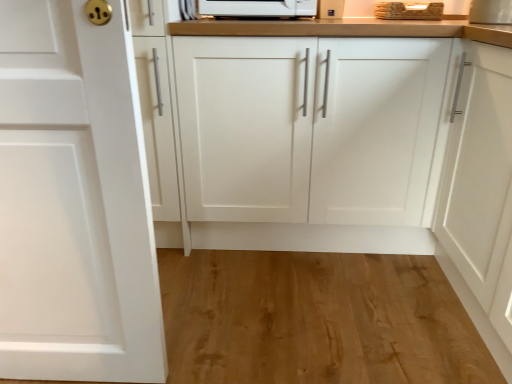
At what (x,y) coordinates should I click in order to perform the action: click on natural wood flooring at lower center. Please return your answer as a coordinate pair (x, y). This screenshot has height=384, width=512. Looking at the image, I should click on (316, 319).

Where is `white matte cabinet at center, which appears as the second cabinetry when viewed from the left`? This screenshot has width=512, height=384. white matte cabinet at center, which appears as the second cabinetry when viewed from the left is located at coordinates [310, 128].

Find the location of a particular element. Image resolution: width=512 pixels, height=384 pixels. natural wood flooring at lower center is located at coordinates (316, 319).

Does natural wood flooring at lower center lie in front of metallic silver toaster at upper center?

Yes.

Does point (301, 365) come farther from viewer compared to point (332, 18)?

No, (301, 365) is closer to viewer.

From a real-world perspective, is natural wood flooring at lower center over metallic silver toaster at upper center?

Incorrect, from a real-world perspective, natural wood flooring at lower center is lower than metallic silver toaster at upper center.

In the scene shown: From the image's perspective, between natural wood flooring at lower center and metallic silver toaster at upper center, which one is located above?

metallic silver toaster at upper center appears higher in the image.

Considering the positions of objects white matte cabinet at center, which appears as the second cabinetry when viewed from the left, and metallic silver toaster at upper center in the image provided, who is behind, white matte cabinet at center, which appears as the second cabinetry when viewed from the left, or metallic silver toaster at upper center?

metallic silver toaster at upper center is more distant.

From a real-world perspective, is white matte cabinet at center, which appears as the second cabinetry when viewed from the left, on top of metallic silver toaster at upper center?

No.

Considering the sizes of white matte cabinet at center, which is the 1th cabinetry in back-to-front order, and metallic silver toaster at upper center in the image, is white matte cabinet at center, which is the 1th cabinetry in back-to-front order, wider or thinner than metallic silver toaster at upper center?

Considering their sizes, white matte cabinet at center, which is the 1th cabinetry in back-to-front order, looks broader than metallic silver toaster at upper center.

Is there a large distance between white matte cabinet at center, the first cabinetry in the right-to-left sequence, and metallic silver toaster at upper center?

Actually, white matte cabinet at center, the first cabinetry in the right-to-left sequence, and metallic silver toaster at upper center are a little close together.

Is white matte cabinet at center, which is the 1th cabinetry in back-to-front order, located outside natural wood flooring at lower center?

Yes.

Which is further, (419, 80) or (212, 351)?

Positioned behind is point (419, 80).

Is white matte cabinet at center, which is the 1th cabinetry in back-to-front order, taller or shorter than natural wood flooring at lower center?

Considering their sizes, white matte cabinet at center, which is the 1th cabinetry in back-to-front order, has more height than natural wood flooring at lower center.

From the image's perspective, which one is positioned higher, white matte cabinet at center, acting as the 2th cabinetry starting from the front, or natural wood flooring at lower center?

white matte cabinet at center, acting as the 2th cabinetry starting from the front.

Consider the image. Which object is further away from the camera, white matte cabinet door at left, which is the 1th cabinetry from front to back, or wooden at upper right?

Positioned behind is wooden at upper right.

Looking at this image, from the image's perspective, which object appears higher, white matte cabinet door at left, placed as the first cabinetry when sorted from left to right, or wooden at upper right?

wooden at upper right is shown above in the image.

Would you say white matte cabinet door at left, which is the 1th cabinetry from front to back, is inside or outside wooden at upper right?

white matte cabinet door at left, which is the 1th cabinetry from front to back, is outside wooden at upper right.

Would you consider white matte cabinet door at left, acting as the 2th cabinetry starting from the back, to be distant from wooden at upper right?

Yes, white matte cabinet door at left, acting as the 2th cabinetry starting from the back, is far from wooden at upper right.

Is point (335, 9) in front of point (224, 52)?

No, (335, 9) is further to viewer.

Who is smaller, metallic silver toaster at upper center or white matte cabinet at center, acting as the 2th cabinetry starting from the front?

metallic silver toaster at upper center.

Can you confirm if metallic silver toaster at upper center is shorter than white matte cabinet at center, which appears as the second cabinetry when viewed from the left?

Yes, metallic silver toaster at upper center is shorter than white matte cabinet at center, which appears as the second cabinetry when viewed from the left.

Which object is closer to the camera, metallic silver toaster at upper center or white matte cabinet at center, acting as the 2th cabinetry starting from the front?

Positioned in front is white matte cabinet at center, acting as the 2th cabinetry starting from the front.

Can you tell me how much natural wood flooring at lower center and white matte cabinet at center, acting as the 2th cabinetry starting from the front, differ in facing direction?

Answer: The angular difference between natural wood flooring at lower center and white matte cabinet at center, acting as the 2th cabinetry starting from the front, is 90.7 degrees.

Which object is further away from the camera, natural wood flooring at lower center or white matte cabinet at center, which appears as the second cabinetry when viewed from the left?

white matte cabinet at center, which appears as the second cabinetry when viewed from the left.

Which object is thinner, natural wood flooring at lower center or white matte cabinet at center, the first cabinetry in the right-to-left sequence?

white matte cabinet at center, the first cabinetry in the right-to-left sequence, is thinner.

From a real-world perspective, which is physically below, natural wood flooring at lower center or white matte cabinet at center, the first cabinetry in the right-to-left sequence?

natural wood flooring at lower center is physically lower.

Does white matte cabinet at center, which appears as the second cabinetry when viewed from the left, turn towards wooden at upper right?

No, white matte cabinet at center, which appears as the second cabinetry when viewed from the left, is not aimed at wooden at upper right.

Is white matte cabinet at center, the first cabinetry in the right-to-left sequence, in front of or behind wooden at upper right in the image?

In the image, white matte cabinet at center, the first cabinetry in the right-to-left sequence, appears in front of wooden at upper right.

Are white matte cabinet at center, acting as the 2th cabinetry starting from the front, and wooden at upper right making contact?

A: They are not placed beside each other.

Does point (391, 159) lie in front of point (382, 8)?

Yes, point (391, 159) is closer to viewer.

At what (x,y) coordinates should I click in order to perform the action: click on hardwood located underneath the metallic silver toaster at upper center (from a real-world perspective). Please return your answer as a coordinate pair (x, y). Image resolution: width=512 pixels, height=384 pixels. Looking at the image, I should click on (316, 319).

This screenshot has width=512, height=384. I want to click on the 1st cabinetry in front when counting from the metallic silver toaster at upper center, so click(x=310, y=128).

Considering their positions, is white matte cabinet door at left, placed as the second cabinetry when sorted from right to left, positioned closer to wooden at upper right than metallic silver toaster at upper center?

The object closer to wooden at upper right is metallic silver toaster at upper center.

Based on their spatial positions, is natural wood flooring at lower center or wooden at upper right closer to white matte cabinet door at left, placed as the first cabinetry when sorted from left to right?

Based on the image, natural wood flooring at lower center appears to be nearer to white matte cabinet door at left, placed as the first cabinetry when sorted from left to right.

When comparing their distances from white matte cabinet at center, which is the 1th cabinetry in back-to-front order, does white matte cabinet door at left, placed as the second cabinetry when sorted from right to left, or wooden at upper right seem further?

The object further to white matte cabinet at center, which is the 1th cabinetry in back-to-front order, is white matte cabinet door at left, placed as the second cabinetry when sorted from right to left.

From the image, which object appears to be nearer to natural wood flooring at lower center, white matte cabinet at center, which is the 1th cabinetry in back-to-front order, or white matte cabinet door at left, which is the 1th cabinetry from front to back?

white matte cabinet at center, which is the 1th cabinetry in back-to-front order, is positioned closer to the anchor natural wood flooring at lower center.

Based on their spatial positions, is wooden at upper right or white matte cabinet at center, acting as the 2th cabinetry starting from the front, closer to natural wood flooring at lower center?

white matte cabinet at center, acting as the 2th cabinetry starting from the front, is closer to natural wood flooring at lower center.

Based on their spatial positions, is white matte cabinet door at left, which is the 1th cabinetry from front to back, or wooden at upper right further from natural wood flooring at lower center?

wooden at upper right lies further to natural wood flooring at lower center than the other object.

Based on their spatial positions, is metallic silver toaster at upper center or wooden at upper right further from white matte cabinet door at left, placed as the second cabinetry when sorted from right to left?

Among the two, wooden at upper right is located further to white matte cabinet door at left, placed as the second cabinetry when sorted from right to left.

Considering their positions, is natural wood flooring at lower center positioned further to white matte cabinet door at left, placed as the first cabinetry when sorted from left to right, than metallic silver toaster at upper center?

Among the two, metallic silver toaster at upper center is located further to white matte cabinet door at left, placed as the first cabinetry when sorted from left to right.

Locate an element on the screen. This screenshot has height=384, width=512. sink between metallic silver toaster at upper center and natural wood flooring at lower center in the vertical direction is located at coordinates (409, 10).

Find the location of `cabinetry that lies between metallic silver toaster at upper center and white matte cabinet door at left, acting as the 2th cabinetry starting from the back, from top to bottom`. cabinetry that lies between metallic silver toaster at upper center and white matte cabinet door at left, acting as the 2th cabinetry starting from the back, from top to bottom is located at coordinates (310, 128).

The width and height of the screenshot is (512, 384). I want to click on appliance between white matte cabinet door at left, placed as the second cabinetry when sorted from right to left, and wooden at upper right, so click(330, 9).

Where is `cabinetry between white matte cabinet door at left, acting as the 2th cabinetry starting from the back, and wooden at upper right from left to right`? cabinetry between white matte cabinet door at left, acting as the 2th cabinetry starting from the back, and wooden at upper right from left to right is located at coordinates (310, 128).